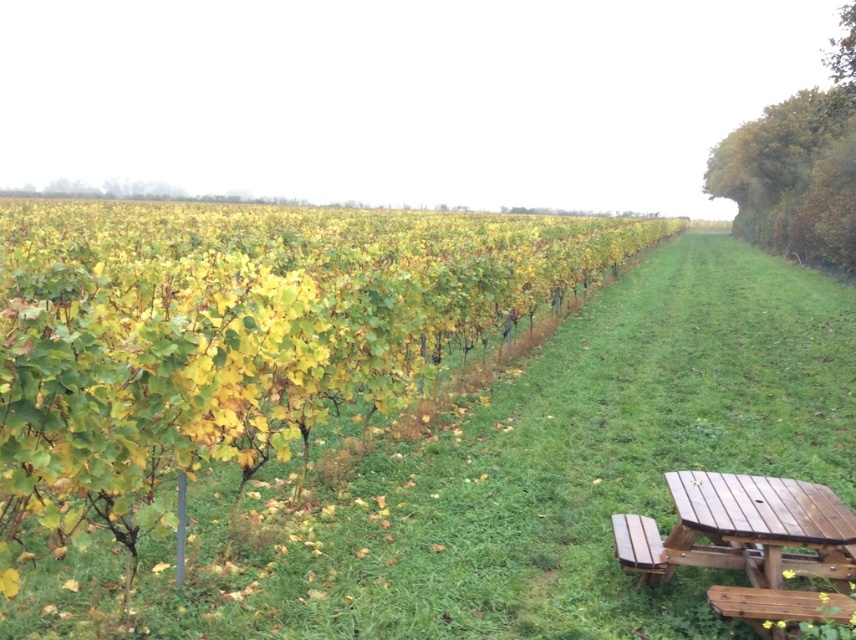
You are planning to set up a small tent in the vineyard scene. The tent requires a flat area wider than the wooden bench at lower right. Based on the scene, is there enough space on the green grassy at center to accommodate the tent?

The green grassy at center has a larger width than the wooden bench at lower right, so there is sufficient space to set up the tent there.

You are a visitor at the vineyard and want to sit down. You see the wooden picnic table at lower right and the wooden bench at lower right. Which one is higher from the ground?

The wooden picnic table at lower right is taller than the wooden bench at lower right, so the wooden picnic table at lower right is higher from the ground.

You are standing at the picnic table and want to walk to the point marked as point (663, 564). Which direction should you go relative to the point marked as point (756, 538)?

You should move away from the point marked as point (756, 538) because point (663, 564) is farther from the viewer compared to point (756, 538).